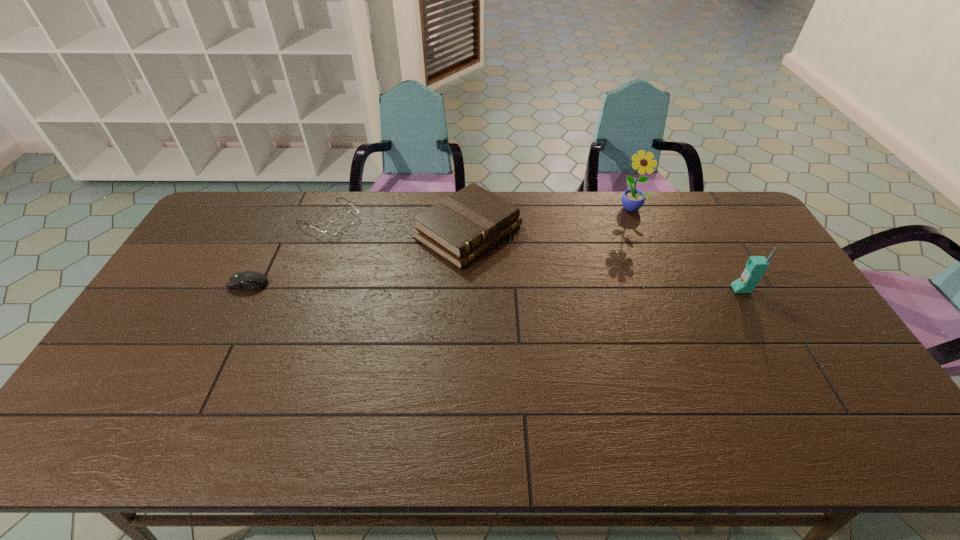
In the image, there is a desktop. Identify the location of blank space at the right edge. The image size is (960, 540). (758, 285).

Locate an element on the screen. The height and width of the screenshot is (540, 960). free space at the far left corner of the desktop is located at coordinates (240, 192).

Image resolution: width=960 pixels, height=540 pixels. Identify the location of free region at the far right corner of the desktop. (705, 223).

Locate an element on the screen. free space between the second tallest object and the shortest object is located at coordinates (494, 287).

What are the coordinates of `empty location between the Bible and the cellular telephone` in the screenshot? It's located at coord(604,260).

Identify the location of free space that is in between the shortest object and the cellular telephone. The width and height of the screenshot is (960, 540). (494, 287).

Locate an element on the screen. free area in between the cellular telephone and the third object from right to left is located at coordinates (604, 260).

I want to click on vacant space in between the third tallest object and the computer equipment, so click(x=358, y=258).

This screenshot has height=540, width=960. Identify the location of unoccupied area between the computer equipment and the spectacles. (289, 251).

What are the coordinates of `free space between the computer equipment and the second tallest object` in the screenshot? It's located at (494, 287).